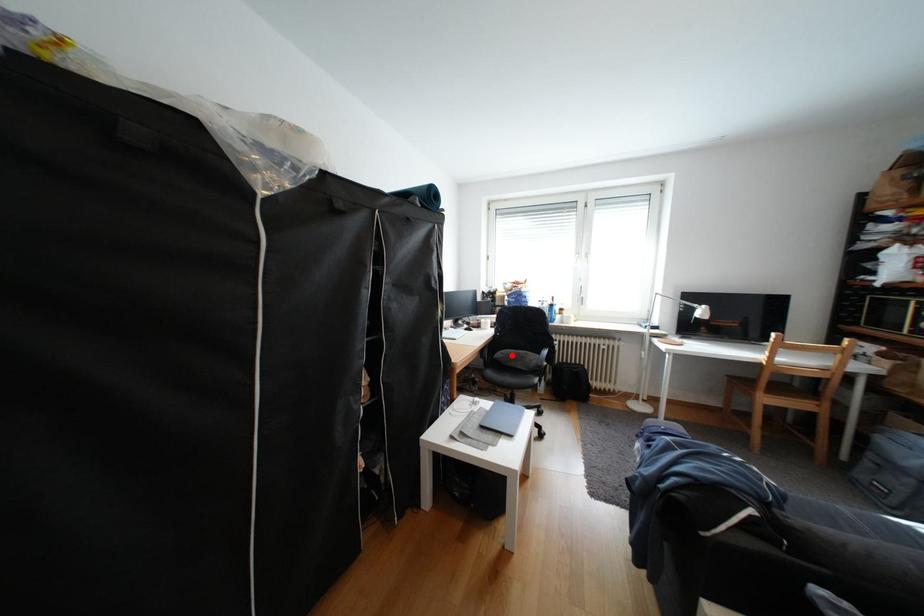
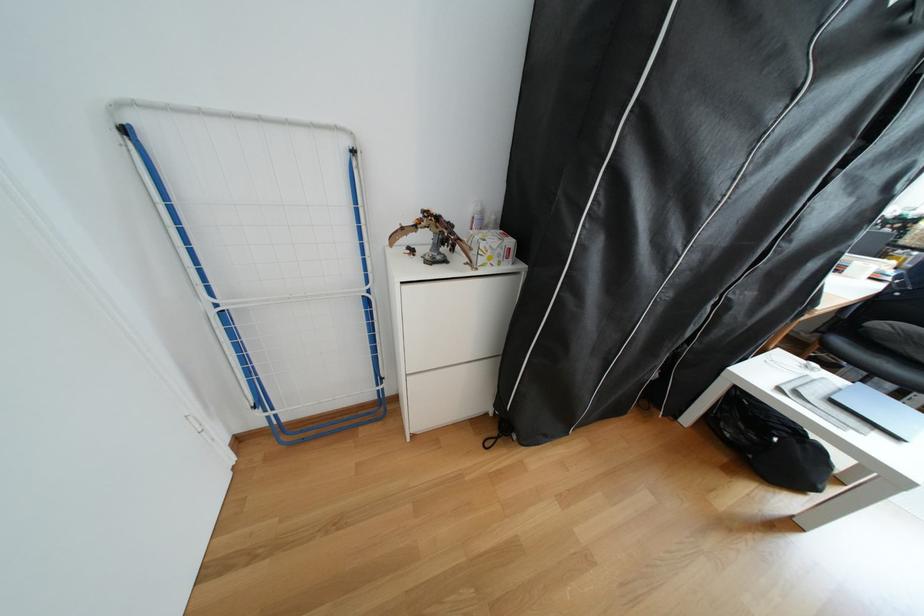
Question: I am providing you with two images of the same scene from different viewpoints. A red point is shown in image1. For the corresponding object point in image2, is it positioned nearer or farther from the camera?

Choices:
 (A) Nearer
 (B) Farther

Answer: (B)